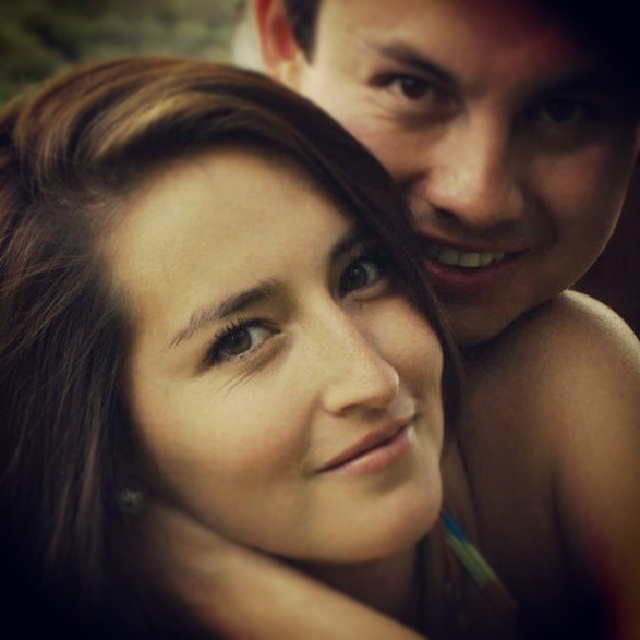
Question: Does matte skin at center appear on the right side of smooth skin face at upper right?

Choices:
 (A) no
 (B) yes

Answer: (A)

Question: Does matte skin at center have a greater width compared to smooth skin face at upper right?

Choices:
 (A) yes
 (B) no

Answer: (B)

Question: Which of the following is the farthest from the observer?

Choices:
 (A) (477, 324)
 (B) (211, 88)

Answer: (A)

Question: Among these objects, which one is farthest from the camera?

Choices:
 (A) smooth skin face at upper right
 (B) matte skin at center

Answer: (A)

Question: Is matte skin at center below smooth skin face at upper right?

Choices:
 (A) yes
 (B) no

Answer: (A)

Question: Which of the following is the farthest from the observer?

Choices:
 (A) matte skin at center
 (B) smooth skin face at upper right

Answer: (B)